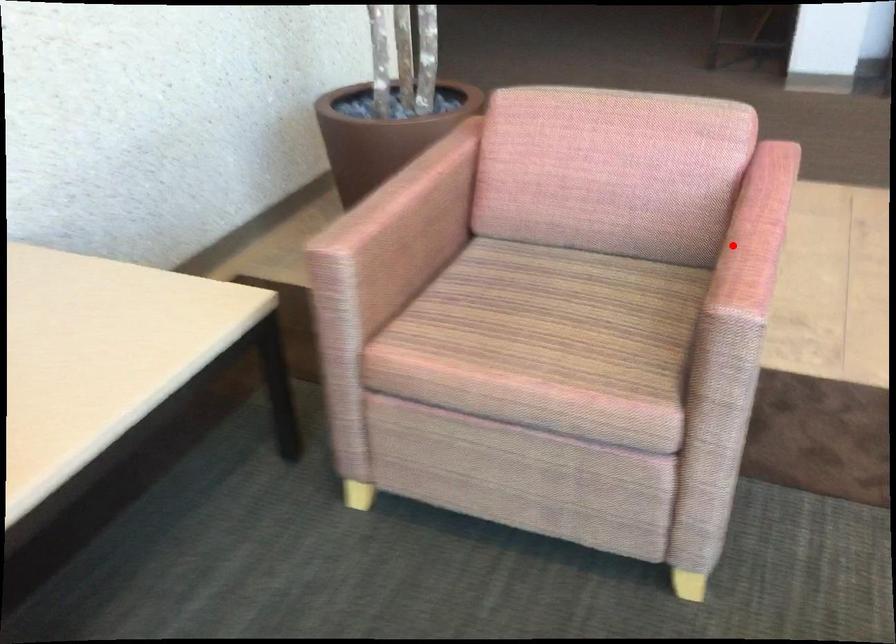
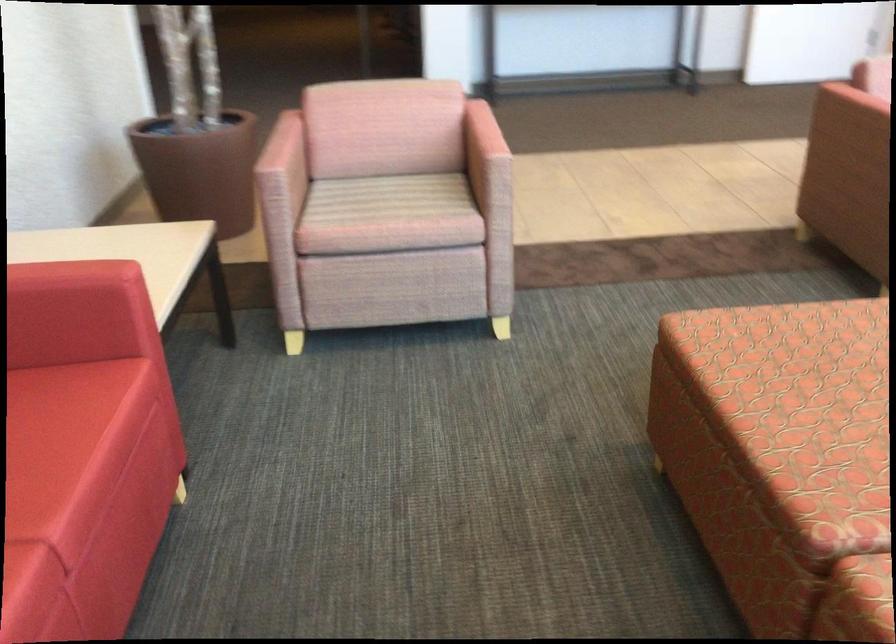
Find the pixel in the second image that matches the highlighted location in the first image.

(481, 133)